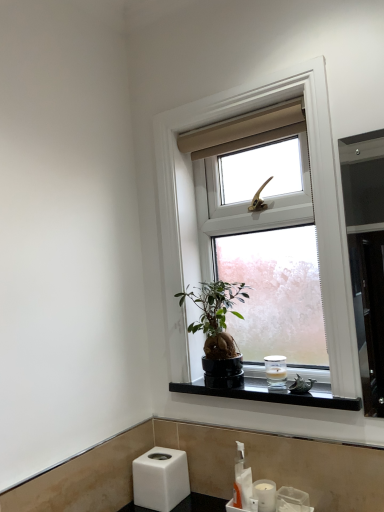
Question: Is black polished stone at lower center oriented towards white frosted glass candle at lower right, positioned as the first toiletry in back-to-front order?

Choices:
 (A) yes
 (B) no

Answer: (B)

Question: Can you confirm if black polished stone at lower center is bigger than white frosted glass candle at lower right, acting as the second toiletry starting from the front?

Choices:
 (A) yes
 (B) no

Answer: (A)

Question: Is black polished stone at lower center looking in the opposite direction of white frosted glass candle at lower right, the 1th toiletry from the top?

Choices:
 (A) no
 (B) yes

Answer: (A)

Question: Does black polished stone at lower center touch white frosted glass candle at lower right, positioned as the second toiletry in bottom-to-top order?

Choices:
 (A) no
 (B) yes

Answer: (A)

Question: Would you consider black polished stone at lower center to be distant from white frosted glass candle at lower right, positioned as the first toiletry in back-to-front order?

Choices:
 (A) no
 (B) yes

Answer: (A)

Question: From a real-world perspective, is white plastic soap dispenser at lower center above or below white frosted glass candle at lower right, acting as the second toiletry starting from the front?

Choices:
 (A) above
 (B) below

Answer: (B)

Question: Is white plastic soap dispenser at lower center bigger or smaller than white frosted glass candle at lower right, the 1th toiletry from the top?

Choices:
 (A) small
 (B) big

Answer: (B)

Question: From the image's perspective, is white plastic soap dispenser at lower center positioned above or below white frosted glass candle at lower right, acting as the second toiletry starting from the front?

Choices:
 (A) below
 (B) above

Answer: (A)

Question: Based on their positions, is white plastic soap dispenser at lower center located to the left or right of white frosted glass candle at lower right, positioned as the first toiletry in back-to-front order?

Choices:
 (A) right
 (B) left

Answer: (B)

Question: From the image's perspective, relative to green matte houseplant at center, is white frosted glass candle at lower right, acting as the second toiletry starting from the front, above or below?

Choices:
 (A) below
 (B) above

Answer: (A)

Question: Looking at their shapes, would you say white frosted glass candle at lower right, acting as the second toiletry starting from the front, is wider or thinner than green matte houseplant at center?

Choices:
 (A) wide
 (B) thin

Answer: (B)

Question: Considering the relative positions of white frosted glass candle at lower right, positioned as the second toiletry in bottom-to-top order, and green matte houseplant at center in the image provided, is white frosted glass candle at lower right, positioned as the second toiletry in bottom-to-top order, to the left or to the right of green matte houseplant at center?

Choices:
 (A) right
 (B) left

Answer: (A)

Question: Looking at the image, does white frosted glass candle at lower right, positioned as the second toiletry in bottom-to-top order, seem bigger or smaller compared to green matte houseplant at center?

Choices:
 (A) big
 (B) small

Answer: (B)

Question: Relative to metallic silver bird at window, is black polished stone at lower center in front or behind?

Choices:
 (A) behind
 (B) front

Answer: (B)

Question: From their relative heights in the image, would you say black polished stone at lower center is taller or shorter than metallic silver bird at window?

Choices:
 (A) tall
 (B) short

Answer: (B)